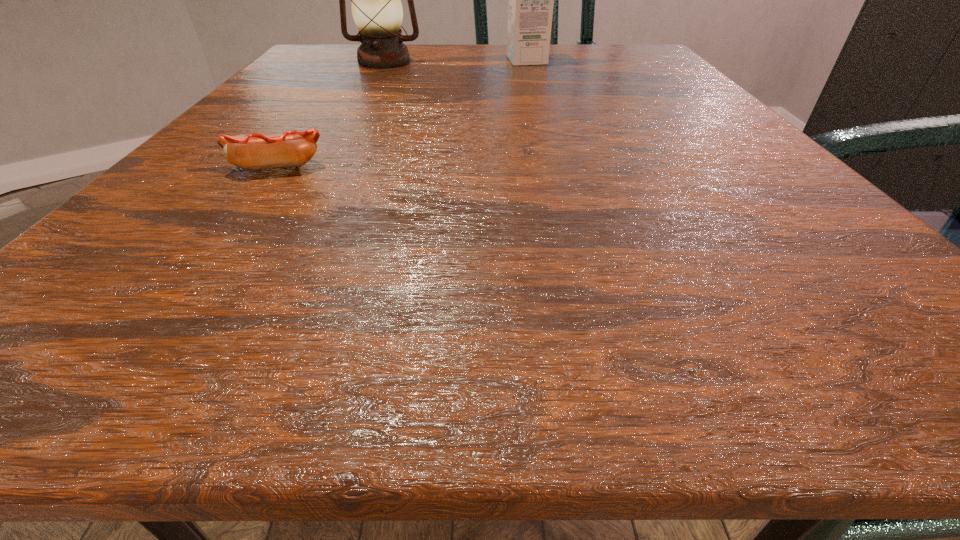
What are the coordinates of `the second closest object relative to the sausage` in the screenshot? It's located at [530, 9].